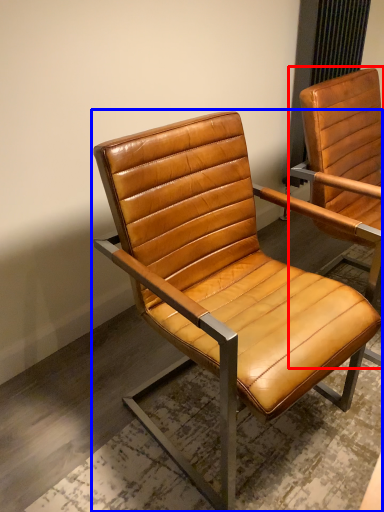
Question: Which object appears closest to the camera in this image, chair (highlighted by a red box) or chair (highlighted by a blue box)?

Choices:
 (A) chair
 (B) chair

Answer: (B)